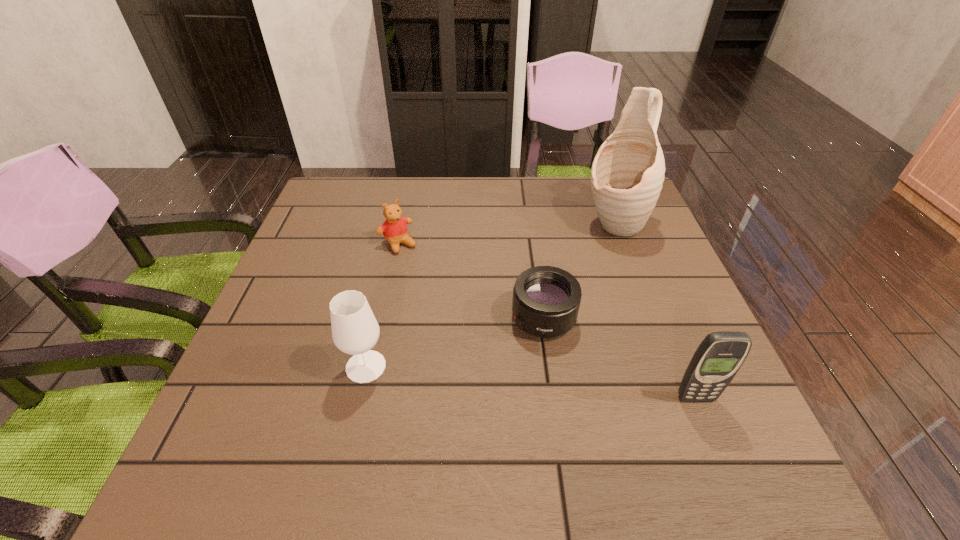
In the image, there is a desktop. Identify the location of vacant space at the near right corner. (730, 407).

Find the location of `free spot between the cellular telephone and the tallest object`. free spot between the cellular telephone and the tallest object is located at coordinates (655, 311).

You are a GUI agent. You are given a task and a screenshot of the screen. Output one action in this format:
    pyautogui.click(x=<x>, y=<y>)
    Task: Click on the free space between the glass and the pitcher
    
    Given the screenshot: What is the action you would take?
    pyautogui.click(x=490, y=295)

Find the location of a particular element. This screenshot has width=960, height=540. vacant space that's between the teddy bear and the third object from right to left is located at coordinates point(470,281).

Where is `vacant area that lies between the cellular telephone and the tallest object`? vacant area that lies between the cellular telephone and the tallest object is located at coordinates (x=655, y=311).

At what (x,y) coordinates should I click in order to perform the action: click on vacant region between the second nearest object and the shortest object. Please return your answer as a coordinate pair (x, y). This screenshot has height=540, width=960. Looking at the image, I should click on (455, 342).

Locate an element on the screen. The image size is (960, 540). blank region between the nearest object and the tallest object is located at coordinates (655, 311).

The width and height of the screenshot is (960, 540). Identify the location of free space between the fourth tallest object and the shortest object. (470, 281).

What are the coordinates of `vacant space that's between the teddy bear and the tallest object` in the screenshot? It's located at click(x=506, y=234).

This screenshot has width=960, height=540. I want to click on vacant area between the glass and the telephoto lens, so pyautogui.click(x=455, y=342).